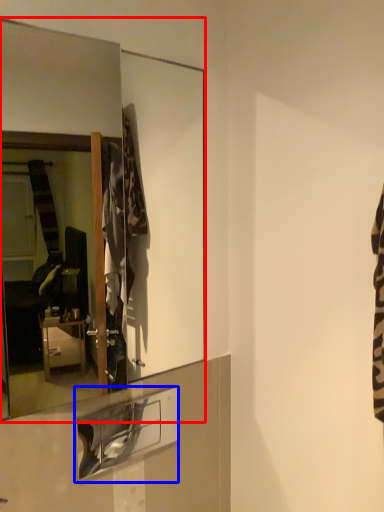
Question: Which object appears farthest to the camera in this image, mirror (highlighted by a red box) or shelf (highlighted by a blue box)?

Choices:
 (A) mirror
 (B) shelf

Answer: (B)